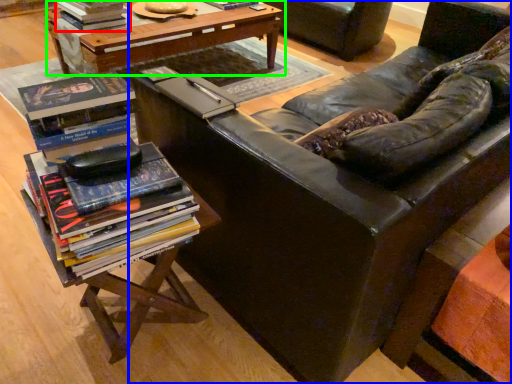
Question: Which object is positioned farthest from book (highlighted by a red box)? Select from studio couch (highlighted by a blue box) and table (highlighted by a green box).

Choices:
 (A) studio couch
 (B) table

Answer: (A)